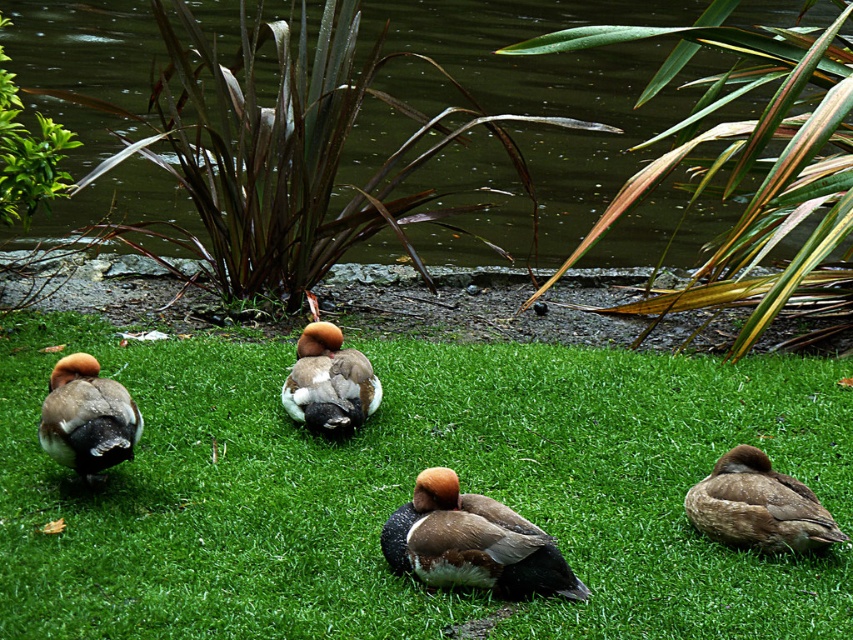
Consider the image. Is green grassy at center thinner than brown fuzzy duck at center?

No, green grassy at center is not thinner than brown fuzzy duck at center.

Which is in front, point (622, 486) or point (360, 378)?

Point (622, 486) is in front.

Between point (196, 388) and point (300, 365), which one is positioned behind?

Positioned behind is point (196, 388).

I want to click on green grassy at center, so click(410, 490).

Does greenish water at center have a greater width compared to brown fuzzy duck at lower left?

Yes.

Does greenish water at center have a lesser width compared to brown fuzzy duck at lower left?

No, greenish water at center is not thinner than brown fuzzy duck at lower left.

Who is more distant from viewer, (688, 211) or (64, 400)?

Point (688, 211)

Where is `greenish water at center`? greenish water at center is located at coordinates (596, 81).

Between brown matte duck at center and brown fuzzy duck at lower right, which one is positioned lower?

brown matte duck at center

Between point (418, 552) and point (755, 480), which one is positioned behind?

The point (755, 480) is behind.

Find the location of a particular element. The height and width of the screenshot is (640, 853). brown matte duck at center is located at coordinates (473, 541).